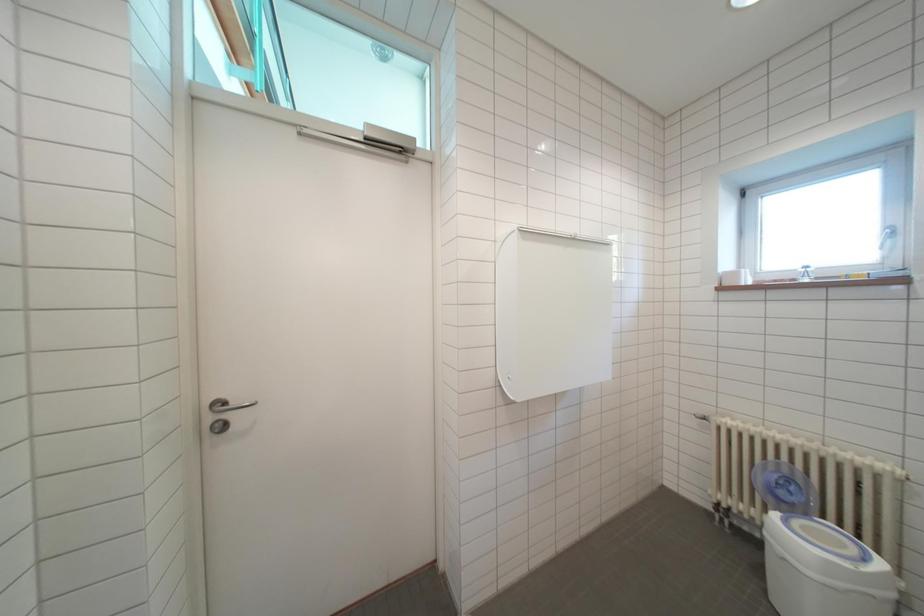
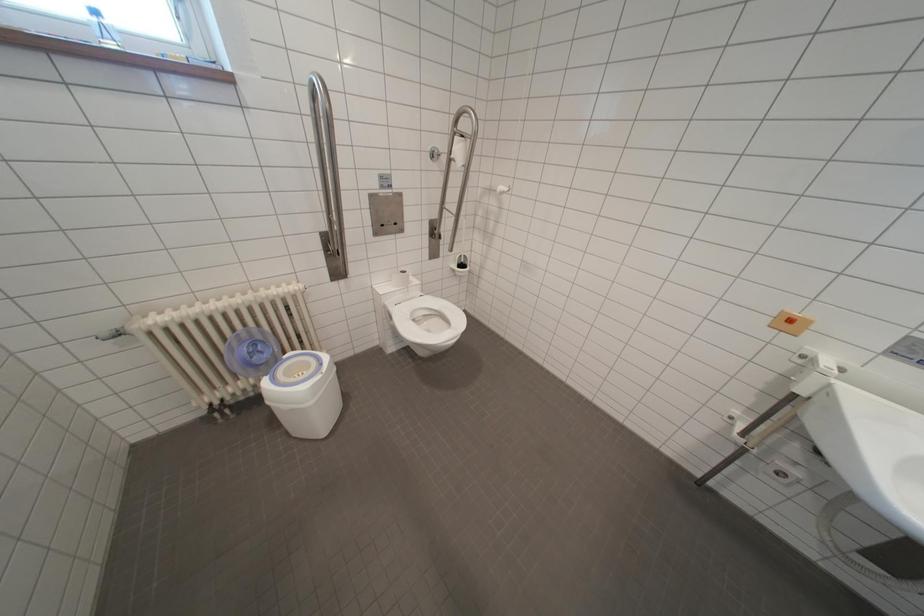
In the scene shown: How did the camera likely rotate?

The rotation direction of the camera is right-down.